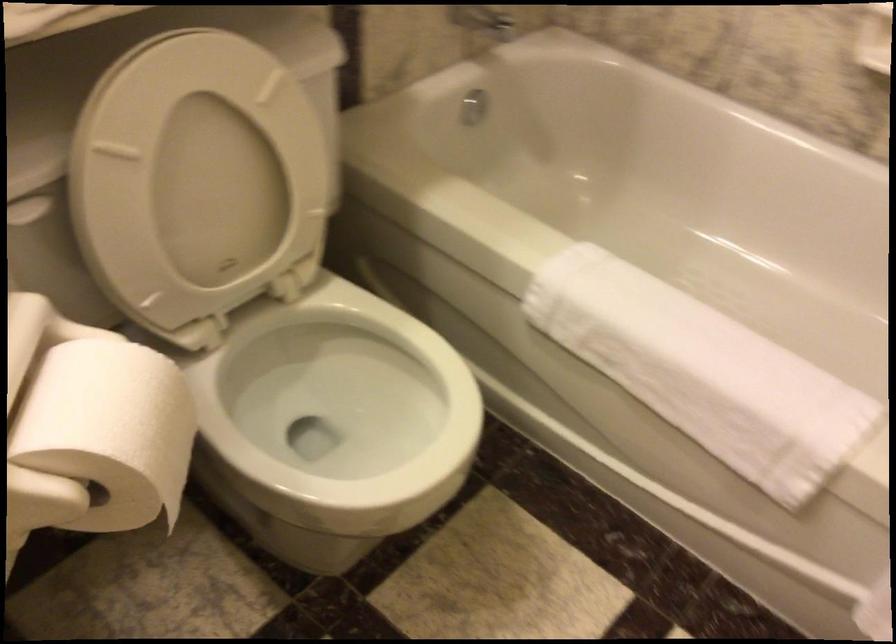
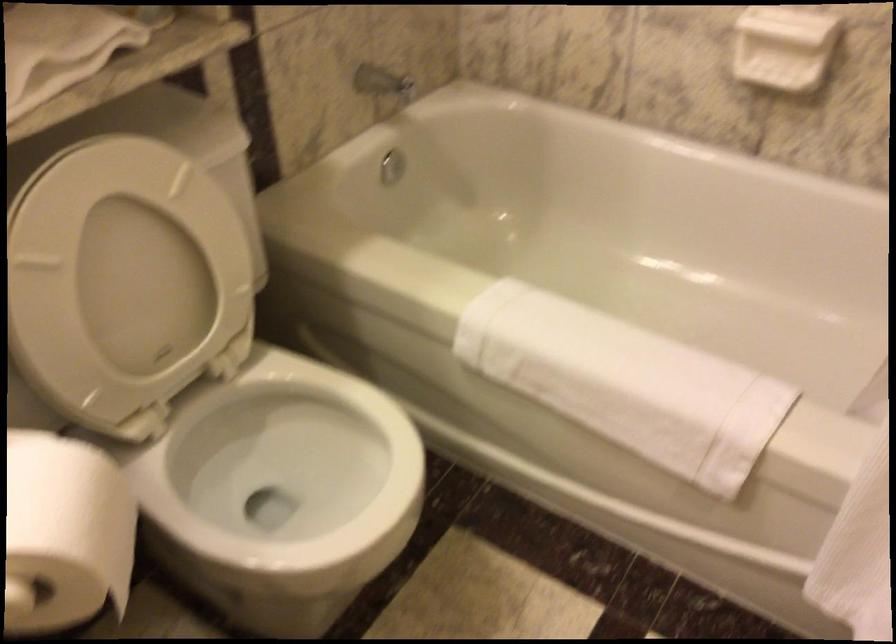
Find the pixel in the second image that matches point 700,366 in the first image.

(625, 383)